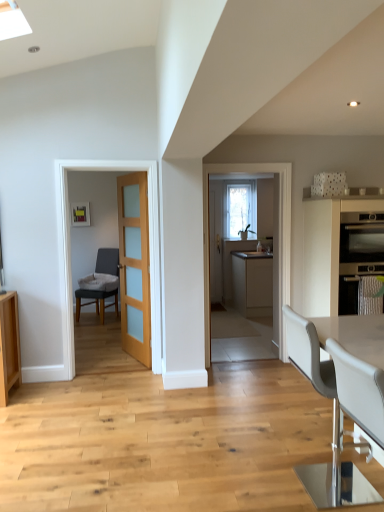
Question: Is matte beige cabinet at center, the first cabinetry when ordered from back to front, bigger than white leather chair at lower right, positioned as the 1th chair in front-to-back order?

Choices:
 (A) no
 (B) yes

Answer: (B)

Question: Considering the relative sizes of matte beige cabinet at center, the first cabinetry when ordered from back to front, and white leather chair at lower right, the third chair from the back, in the image provided, is matte beige cabinet at center, the first cabinetry when ordered from back to front, smaller than white leather chair at lower right, the third chair from the back,?

Choices:
 (A) no
 (B) yes

Answer: (A)

Question: Is matte beige cabinet at center, which is counted as the second cabinetry, starting from the front, wider than white leather chair at lower right, the third chair from the back?

Choices:
 (A) yes
 (B) no

Answer: (A)

Question: Is the position of matte beige cabinet at center, the first cabinetry when ordered from back to front, more distant than that of white leather chair at lower right, acting as the second chair starting from the left?

Choices:
 (A) no
 (B) yes

Answer: (B)

Question: Can you confirm if matte beige cabinet at center, the first cabinetry when ordered from back to front, is shorter than white leather chair at lower right, the third chair from the back?

Choices:
 (A) no
 (B) yes

Answer: (A)

Question: In terms of size, does white leather chair at lower right, the 2th chair positioned from the back, appear bigger or smaller than clear glass window at center?

Choices:
 (A) big
 (B) small

Answer: (A)

Question: Considering the positions of point (288, 307) and point (230, 231), is point (288, 307) closer or farther from the camera than point (230, 231)?

Choices:
 (A) closer
 (B) farther

Answer: (A)

Question: Which is correct: white leather chair at lower right, which appears as the third chair when viewed from the left, is inside clear glass window at center, or outside of it?

Choices:
 (A) outside
 (B) inside

Answer: (A)

Question: Looking at their shapes, would you say white leather chair at lower right, the 1th chair viewed from the right, is wider or thinner than clear glass window at center?

Choices:
 (A) wide
 (B) thin

Answer: (A)

Question: Visually, is matte beige cabinet at center, which is counted as the second cabinetry, starting from the front, positioned to the left or to the right of white leather chair at lower right, the third chair from the back?

Choices:
 (A) right
 (B) left

Answer: (A)

Question: Is matte beige cabinet at center, which is counted as the second cabinetry, starting from the front, wider or thinner than white leather chair at lower right, the third chair from the back?

Choices:
 (A) wide
 (B) thin

Answer: (A)

Question: From a real-world perspective, is matte beige cabinet at center, the first cabinetry when ordered from back to front, above or below white leather chair at lower right, positioned as the 1th chair in front-to-back order?

Choices:
 (A) below
 (B) above

Answer: (A)

Question: Relative to white leather chair at lower right, marked as the second chair in a right-to-left arrangement, is matte beige cabinet at center, the first cabinetry when ordered from back to front, in front or behind?

Choices:
 (A) front
 (B) behind

Answer: (B)

Question: From a real-world perspective, is light brown wood door at center positioned above or below matte stainless steel oven at right?

Choices:
 (A) below
 (B) above

Answer: (A)

Question: Visually, is light brown wood door at center positioned to the left or to the right of matte stainless steel oven at right?

Choices:
 (A) left
 (B) right

Answer: (A)